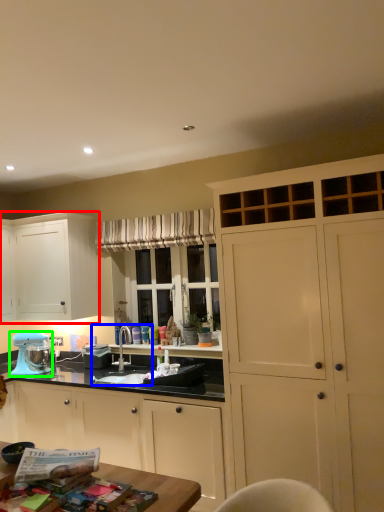
Question: Which object is the farthest from cabinetry (highlighted by a red box)? Choose among these: sink (highlighted by a blue box) or home appliance (highlighted by a green box).

Choices:
 (A) sink
 (B) home appliance

Answer: (A)